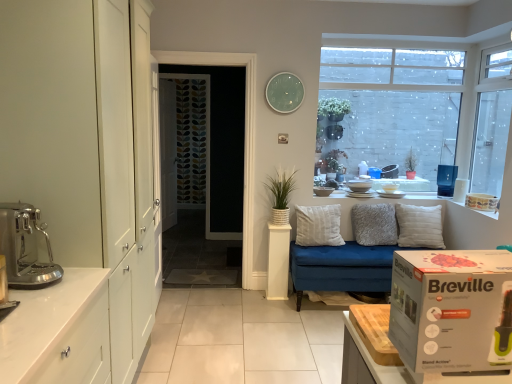
This screenshot has width=512, height=384. I want to click on free location to the right of metallic stainless steel coffee machine at left, acting as the first appliance starting from the bottom, so click(33, 307).